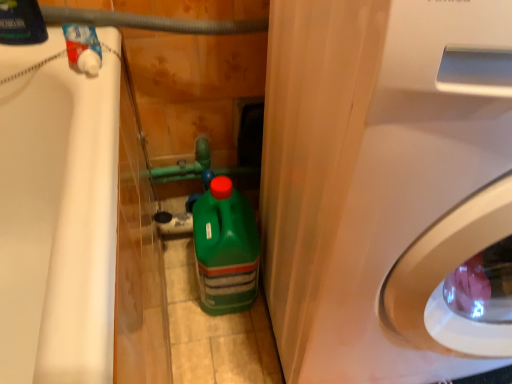
Locate an element on the screen. The width and height of the screenshot is (512, 384). matte black bottle at upper left is located at coordinates (21, 23).

Identify the location of green plastic bottle at center. The height and width of the screenshot is (384, 512). (225, 249).

Is matte black bottle at upper left inside the boundaries of white glossy washing machine at center right, or outside?

matte black bottle at upper left cannot be found inside white glossy washing machine at center right.

Considering the sizes of objects matte black bottle at upper left and white glossy washing machine at center right in the image provided, who is smaller, matte black bottle at upper left or white glossy washing machine at center right?

With smaller size is matte black bottle at upper left.

From the image's perspective, between matte black bottle at upper left and white glossy washing machine at center right, who is located below?

white glossy washing machine at center right is shown below in the image.

In the image, is matte black bottle at upper left positioned in front of or behind white glossy washing machine at center right?

Visually, matte black bottle at upper left is located behind white glossy washing machine at center right.

From the image's perspective, between rubber hose at upper center and green plastic bottle at center, which one is located above?

rubber hose at upper center.

Is rubber hose at upper center in front of or behind green plastic bottle at center in the image?

rubber hose at upper center is positioned closer to the viewer than green plastic bottle at center.

The width and height of the screenshot is (512, 384). I want to click on water pipe in front of the green plastic bottle at center, so click(150, 22).

Considering the relative sizes of rubber hose at upper center and green plastic bottle at center in the image provided, is rubber hose at upper center shorter than green plastic bottle at center?

Yes, rubber hose at upper center is shorter than green plastic bottle at center.

From the image's perspective, between green plastic bottle at center and white glossy washing machine at center right, who is located below?

green plastic bottle at center appears lower in the image.

How many degrees apart are the facing directions of green plastic bottle at center and white glossy washing machine at center right?

The angle between the facing direction of green plastic bottle at center and the facing direction of white glossy washing machine at center right is 0.00222 degrees.

You are a GUI agent. You are given a task and a screenshot of the screen. Output one action in this format:
    pyautogui.click(x=<x>, y=<y>)
    Task: Click on the bottle that appears below the white glossy washing machine at center right (from the image's perspective)
    The height and width of the screenshot is (384, 512).
    Given the screenshot: What is the action you would take?
    pyautogui.click(x=225, y=249)

Are green plastic bottle at center and white glossy washing machine at center right beside each other?

green plastic bottle at center and white glossy washing machine at center right are not in contact.

Is rubber hose at upper center positioned far away from white glossy washing machine at center right?

Actually, rubber hose at upper center and white glossy washing machine at center right are a little close together.

Which point is more forward, (164, 17) or (306, 127)?

The point (306, 127) is in front.

In terms of width, does rubber hose at upper center look wider or thinner when compared to white glossy washing machine at center right?

Considering their sizes, rubber hose at upper center looks slimmer than white glossy washing machine at center right.

Looking at the image, does matte black bottle at upper left seem bigger or smaller compared to green plastic bottle at center?

Considering their sizes, matte black bottle at upper left takes up less space than green plastic bottle at center.

Which is in front, point (3, 0) or point (223, 295)?

The point (3, 0) is closer.

Looking at this image, between matte black bottle at upper left and green plastic bottle at center, which one appears on the left side from the viewer's perspective?

Positioned to the left is matte black bottle at upper left.

From their relative heights in the image, would you say rubber hose at upper center is taller or shorter than matte black bottle at upper left?

Clearly, rubber hose at upper center is shorter compared to matte black bottle at upper left.

From the image's perspective, is rubber hose at upper center above matte black bottle at upper left?

No, from the image's perspective, rubber hose at upper center is not on top of matte black bottle at upper left.

Is rubber hose at upper center aimed at matte black bottle at upper left?

No, rubber hose at upper center is not aimed at matte black bottle at upper left.

Which point is more distant from viewer, (69, 21) or (10, 11)?

The point (69, 21) is farther from the camera.

Considering the sizes of green plastic bottle at center and matte black bottle at upper left in the image, is green plastic bottle at center taller or shorter than matte black bottle at upper left?

Considering their sizes, green plastic bottle at center has more height than matte black bottle at upper left.

From the picture: Measure the distance between green plastic bottle at center and matte black bottle at upper left.

green plastic bottle at center and matte black bottle at upper left are 20.05 inches apart.

Is green plastic bottle at center positioned far away from matte black bottle at upper left?

No.

Identify the location of cleaning product lying above the white glossy washing machine at center right (from the image's perspective). This screenshot has height=384, width=512. (21, 23).

The width and height of the screenshot is (512, 384). Find the location of `bottle that is under the rubber hose at upper center (from a real-world perspective)`. bottle that is under the rubber hose at upper center (from a real-world perspective) is located at coordinates (225, 249).

Looking at this image, when comparing their distances from matte black bottle at upper left, does white glossy washing machine at center right or rubber hose at upper center seem closer?

rubber hose at upper center.

Based on their spatial positions, is green plastic bottle at center or white glossy washing machine at center right further from rubber hose at upper center?

Among the two, white glossy washing machine at center right is located further to rubber hose at upper center.

From the image, which object appears to be farther from matte black bottle at upper left, white glossy washing machine at center right or green plastic bottle at center?

Based on the image, white glossy washing machine at center right appears to be further to matte black bottle at upper left.

Estimate the real-world distances between objects in this image. Which object is closer to green plastic bottle at center, rubber hose at upper center or white glossy washing machine at center right?

white glossy washing machine at center right.

From the picture: From the image, which object appears to be nearer to green plastic bottle at center, white glossy washing machine at center right or matte black bottle at upper left?

Based on the image, white glossy washing machine at center right appears to be nearer to green plastic bottle at center.

Consider the image. When comparing their distances from white glossy washing machine at center right, does matte black bottle at upper left or green plastic bottle at center seem further?

matte black bottle at upper left is positioned further to the anchor white glossy washing machine at center right.

From the image, which object appears to be farther from matte black bottle at upper left, green plastic bottle at center or rubber hose at upper center?

green plastic bottle at center is positioned further to the anchor matte black bottle at upper left.

When comparing their distances from white glossy washing machine at center right, does green plastic bottle at center or matte black bottle at upper left seem further?

Among the two, matte black bottle at upper left is located further to white glossy washing machine at center right.

I want to click on bottle between matte black bottle at upper left and white glossy washing machine at center right from left to right, so click(225, 249).

Locate an element on the screen. The image size is (512, 384). water pipe situated between matte black bottle at upper left and white glossy washing machine at center right from left to right is located at coordinates (150, 22).

At what (x,y) coordinates should I click in order to perform the action: click on water pipe between white glossy washing machine at center right and green plastic bottle at center from front to back. Please return your answer as a coordinate pair (x, y). Looking at the image, I should click on (150, 22).

Where is `water pipe between matte black bottle at upper left and green plastic bottle at center in the vertical direction`? This screenshot has width=512, height=384. water pipe between matte black bottle at upper left and green plastic bottle at center in the vertical direction is located at coordinates (150, 22).